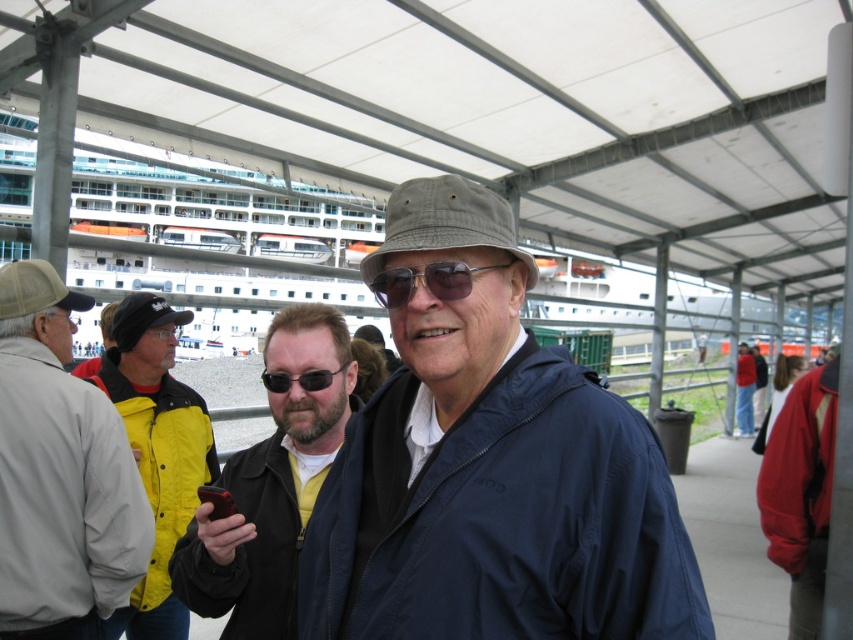
Question: Is red fleece jacket at lower right positioned at the back of khaki fabric bucket hat at center?

Choices:
 (A) yes
 (B) no

Answer: (A)

Question: Which of these objects is positioned closest to the yellow jacket at center?

Choices:
 (A) black matte goggles at upper left
 (B) white metal cruise ship at upper center

Answer: (A)

Question: Which of the following is the farthest from the observer?

Choices:
 (A) tan mesh cap at left
 (B) white metal cruise ship at upper center
 (C) sunglasses at center
 (D) khaki fabric bucket hat at center

Answer: (B)

Question: Does matte black jacket at center have a smaller size compared to khaki fabric bucket hat at center?

Choices:
 (A) no
 (B) yes

Answer: (A)

Question: Among these points, which one is nearest to the camera?

Choices:
 (A) (85, 522)
 (B) (161, 324)
 (C) (19, 298)

Answer: (A)

Question: Where is black fabric cap at left located in relation to red jacket at center in the image?

Choices:
 (A) right
 (B) left

Answer: (B)